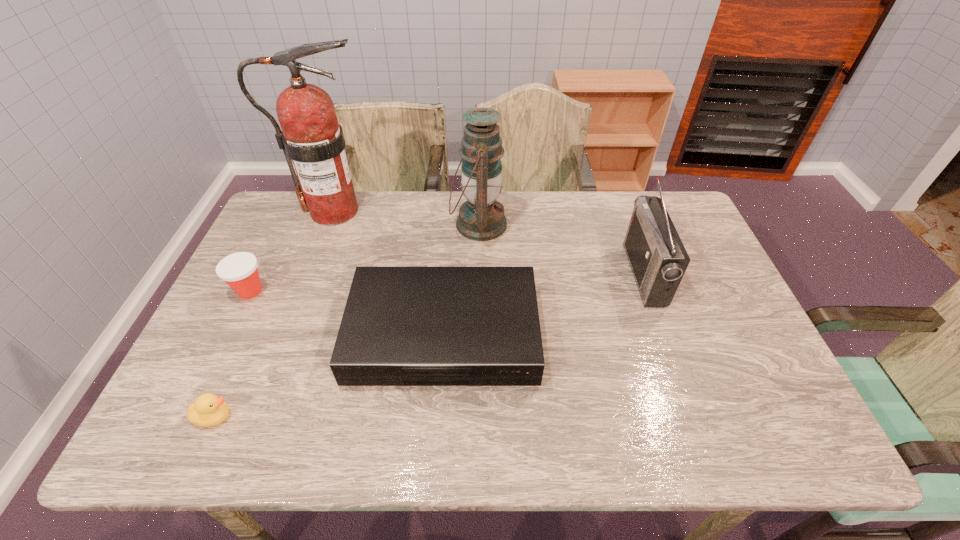
The image size is (960, 540). I want to click on Dixie cup that is at the left edge, so click(239, 270).

Where is `duckling present at the left edge`? The width and height of the screenshot is (960, 540). duckling present at the left edge is located at coordinates (208, 410).

Find the location of a particular element. Image resolution: width=960 pixels, height=540 pixels. object at the far left corner is located at coordinates point(311,136).

The height and width of the screenshot is (540, 960). What are the coordinates of `object located in the near left corner section of the desktop` in the screenshot? It's located at [208, 410].

Locate an element on the screen. This screenshot has height=540, width=960. vacant space at the far edge of the desktop is located at coordinates (608, 226).

Where is `free space at the near edge of the desktop`? free space at the near edge of the desktop is located at coordinates (320, 443).

The width and height of the screenshot is (960, 540). In the image, there is a desktop. Find the location of `vacant space at the right edge`. vacant space at the right edge is located at coordinates (743, 332).

You are a GUI agent. You are given a task and a screenshot of the screen. Output one action in this format:
    pyautogui.click(x=<x>, y=<y>)
    Task: Click on the vacant area that lies between the fifth shortest object and the radio receiver
    
    Given the screenshot: What is the action you would take?
    pyautogui.click(x=562, y=249)

Identify the location of vacant space that is in between the shortest object and the CD player. (328, 376).

Identify the location of free space between the CD player and the shortest object. The width and height of the screenshot is (960, 540). (328, 376).